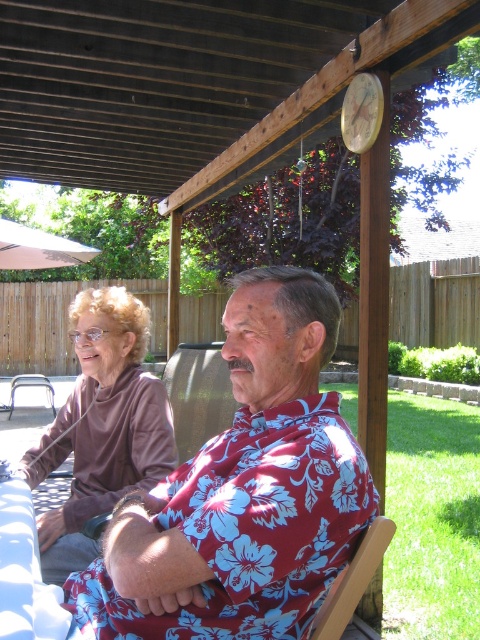
You are a photographer standing behind the wooden chair at lower right, and you want to take a photo of the floral print shirt at center. Can you reach the shirt with your 10 inch long camera lens without moving the chair or the shirt?

The distance between the floral print shirt at center and the wooden chair at lower right is 7.29 inches. Since the camera lens is 10 inches long, it can extend beyond the 7.29 inches needed to reach the shirt. Therefore, yes, you can reach the floral print shirt at center with your 10 inch lens without moving either object.

You are a guest at this backyard gathering and want to sit down. You see the brown fleece sweater at left and the wooden chair at lower right. Is the sweater on the chair or somewhere else?

The brown fleece sweater at left is to the left of the wooden chair at lower right, so it is not on the chair but placed somewhere else nearby.